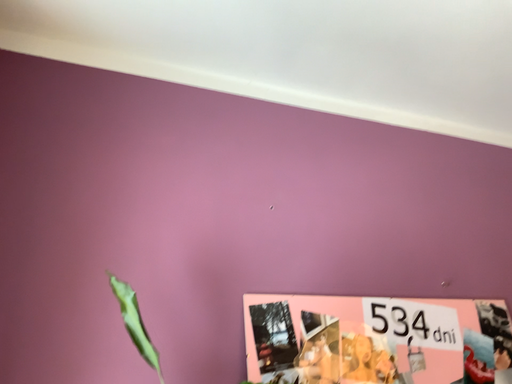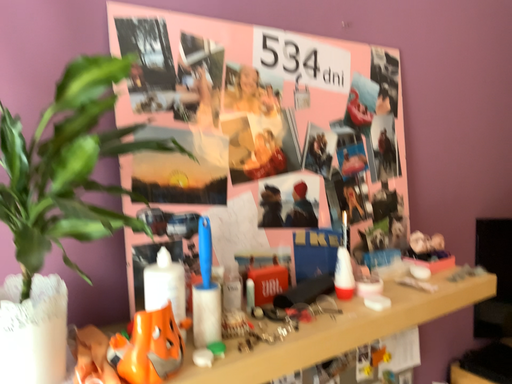
Question: Which way did the camera rotate in the video?

Choices:
 (A) rotated downward
 (B) rotated upward

Answer: (A)